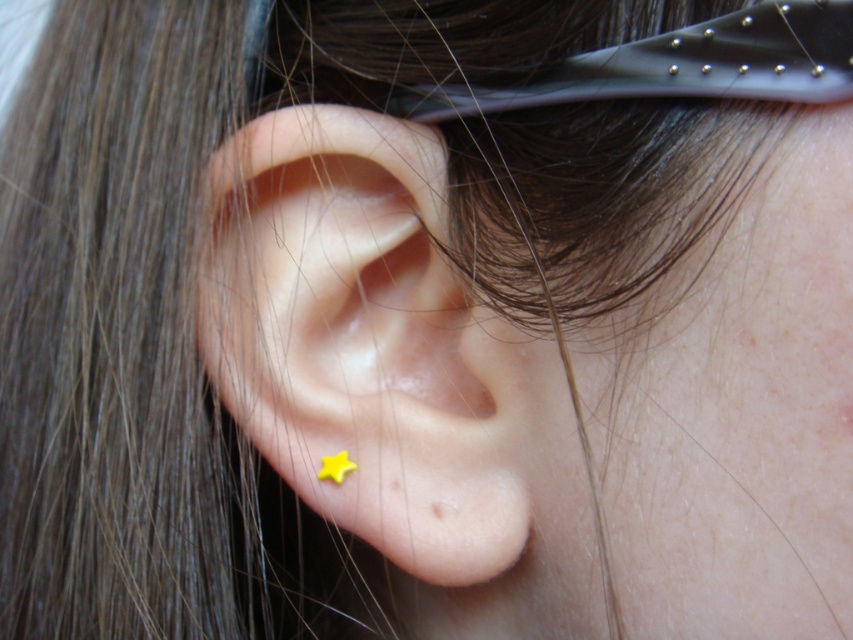
You are a photographer adjusting your camera focus. You notice two yellow matte stars in your viewfinder. The first is labeled as the yellow matte star at center and the second as the yellow matte star at ear. Which one appears closer to you based on the depth of field?

The yellow matte star at center appears closer to the viewer than the yellow matte star at ear based on the depth of field.

You are a photographer reviewing a closeup photo of an ear with two yellow matte stars. The scene shows a yellow matte star at center and a yellow matte star at ear. Which one appears taller in the photo?

The yellow matte star at center has a greater height compared to the yellow matte star at ear, so the yellow matte star at center appears taller in the photo.